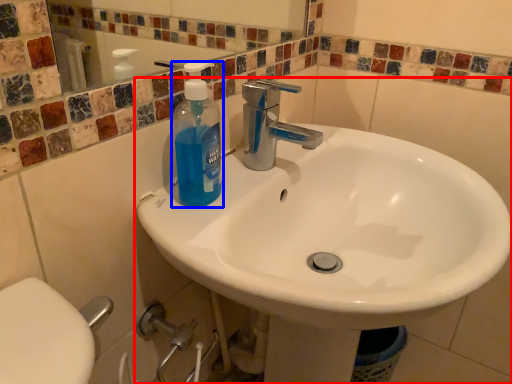
Question: Among these objects, which one is nearest to the camera, sink (highlighted by a red box) or cleaning product (highlighted by a blue box)?

Choices:
 (A) sink
 (B) cleaning product

Answer: (A)